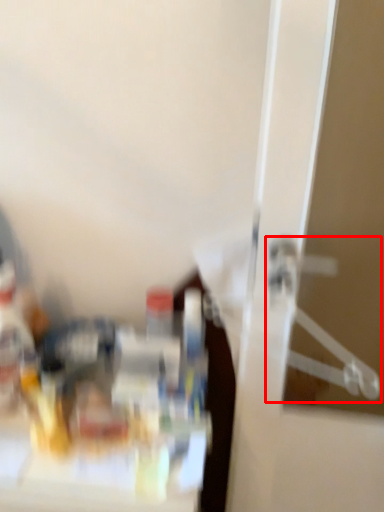
Question: Considering the relative positions of hanger (annotated by the red box) and bottle in the image provided, where is hanger (annotated by the red box) located with respect to the staircase?

Choices:
 (A) left
 (B) right

Answer: (B)